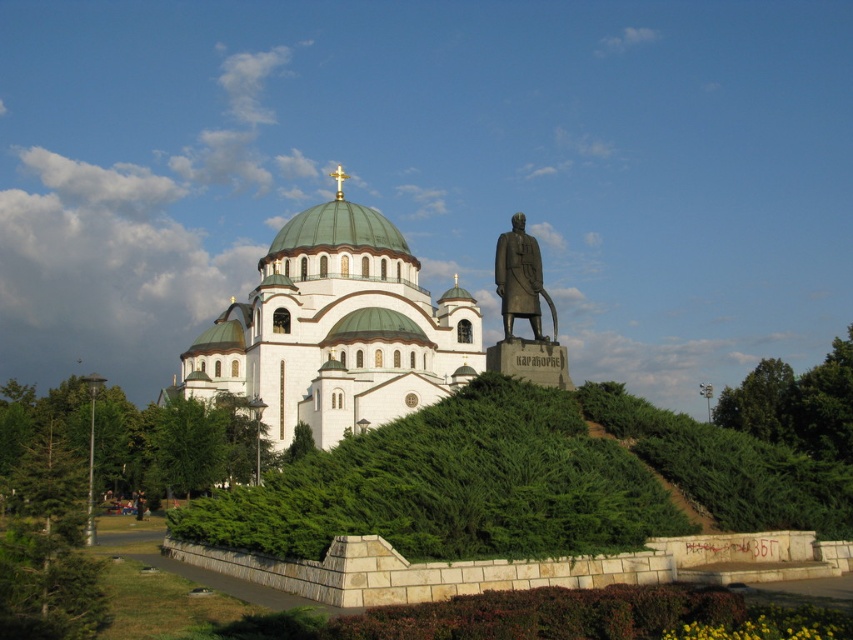
You are standing at a certain distance from the white stone church at center. If you want to take a photo that captures the entire structure without any cropping, would you need to move closer or further away?

The white stone church at center is 77.44 meters away from viewer. To capture the entire structure without cropping, you would need to move further away, as the current distance might be too close to include the full view.

You are a tourist visiting the site and want to take a photo that includes both the white stone church at center and the bronze statue at right. Based on their relative sizes, which one should you focus on to ensure both fit in the frame?

The white stone church at center might be wider than the bronze statue at right, so focusing on the church would ensure both fit in the frame as the statue is likely smaller and positioned to the side.